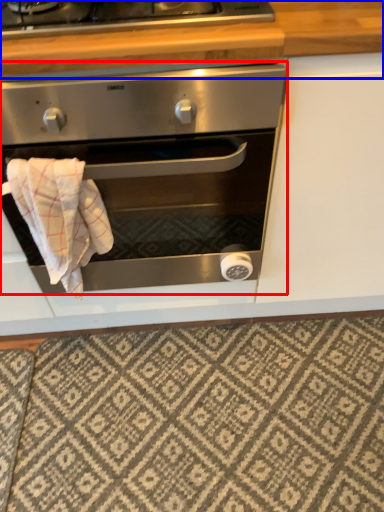
Question: Which object is closer to the camera taking this photo, oven (highlighted by a red box) or counter top (highlighted by a blue box)?

Choices:
 (A) oven
 (B) counter top

Answer: (A)